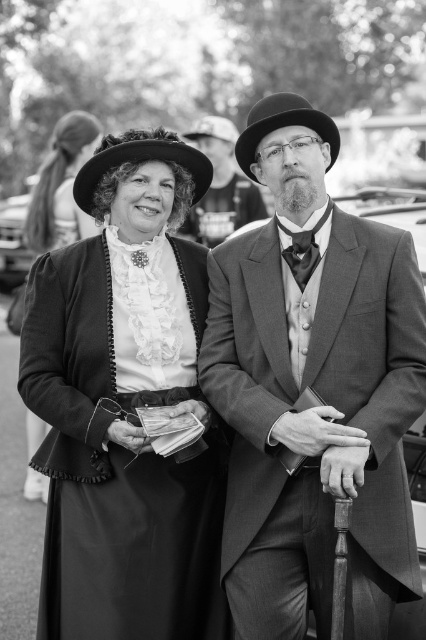
You are standing in front of a historical reenactment scene. There is a point marked at coordinates point (86, 132). Can you walk to that point without moving past the individuals in the scene?

The distance between point (86, 132) and the viewer is 7.90 meters. Since the individuals are part of the scene and the distance is measured from the viewer to the point, you can walk to that point as long as you stay within the 7.90 meters distance and navigate around the individuals if necessary.

You are a costume designer preparing for a historical play. You need to decide which hat from the image to place on a mannequin head that can only accommodate hats up to 25 cm in width. The hats available are the smooth leather hat at center and the shiny black bowler hat at center. Based on the image, which hat would you choose?

The smooth leather hat at center is wider than the shiny black bowler hat at center. Since the mannequin head can only hold up to 25 cm, you should choose the shiny black bowler hat at center to ensure it fits properly.